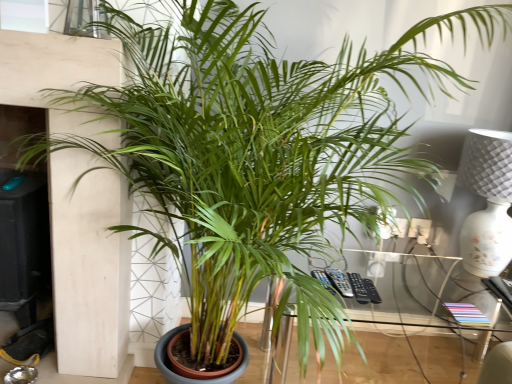
Question: From the image's perspective, is clear glass window at upper center positioned above or below transparent glass table at center?

Choices:
 (A) above
 (B) below

Answer: (A)

Question: From their relative heights in the image, would you say clear glass window at upper center is taller or shorter than transparent glass table at center?

Choices:
 (A) short
 (B) tall

Answer: (A)

Question: Considering the real-world distances, which object is farthest from the transparent glass table at center?

Choices:
 (A) white textured lamp at right
 (B) clear glass window at upper center

Answer: (B)

Question: Considering the real-world distances, which object is farthest from the white textured lamp at right?

Choices:
 (A) transparent glass table at center
 (B) clear glass window at upper center

Answer: (B)